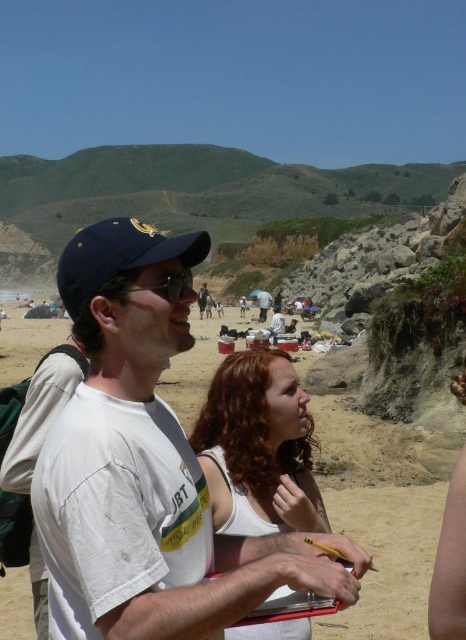
You are a photographer trying to capture a clear shot of the blonde hair at center and the white cotton shirt at center. Since you want both subjects in focus, which one should you adjust your camera focus on first?

You should focus on the blonde hair at center first because it is closer to the viewer than the white cotton shirt at center.

From the picture: You are a photographer trying to capture a photo of the blonde hair at center and the matte black backpack at center. Based on their positions, which object should you focus on first if you want to ensure both are in the frame without moving the camera?

The blonde hair at center is below the matte black backpack at center, so you should focus on the matte black backpack at center first to ensure both are in the frame without moving the camera.

You are standing at the center of the beach scene. You need to locate the navy blue fabric baseball cap at left. Where exactly is it positioned relative to your current location?

The navy blue fabric baseball cap at left is located at point 0.402 on the x axis and 0.255 on the y axis relative to your current position at the center of the beach scene.